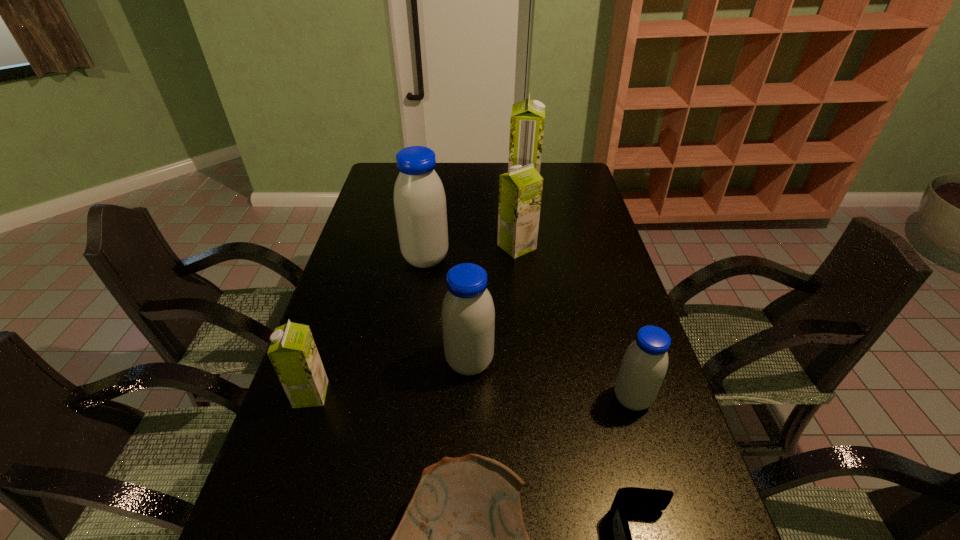
In the image, there is a desktop. Find the location of `free space at the far edge`. free space at the far edge is located at coordinates (473, 166).

This screenshot has width=960, height=540. Identify the location of free space at the left edge of the desktop. (315, 465).

Identify the location of vacant area at the right edge of the desktop. The image size is (960, 540). 681,534.

In the image, there is a desktop. Identify the location of free space at the far left corner. Image resolution: width=960 pixels, height=540 pixels. (383, 179).

Identify the location of vacant space at the far right corner of the desktop. (580, 171).

The width and height of the screenshot is (960, 540). I want to click on empty location between the farthest blue soya milk and the leftmost soya milk, so click(x=369, y=326).

Locate an element on the screen. The image size is (960, 540). free point between the second smallest green soya milk and the rightmost soya milk is located at coordinates (574, 322).

This screenshot has width=960, height=540. I want to click on free space between the fourth soya milk from right to left and the rightmost soya milk, so click(x=551, y=380).

Find the location of a particular element. Image resolution: width=960 pixels, height=540 pixels. empty space that is in between the rightmost soya milk and the second farthest green soya milk is located at coordinates (574, 322).

Identify the location of vacant point located between the farthest blue soya milk and the second smallest green soya milk. point(471,253).